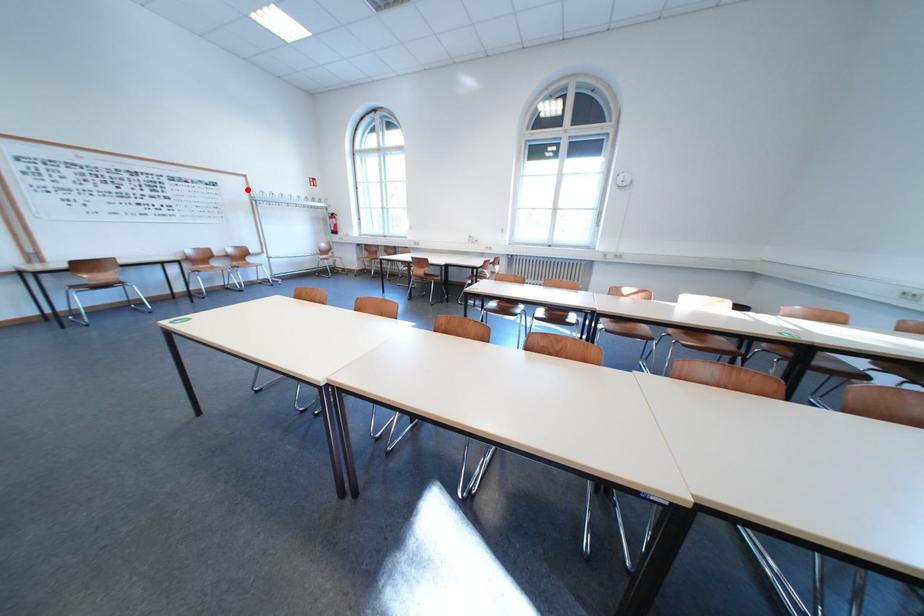
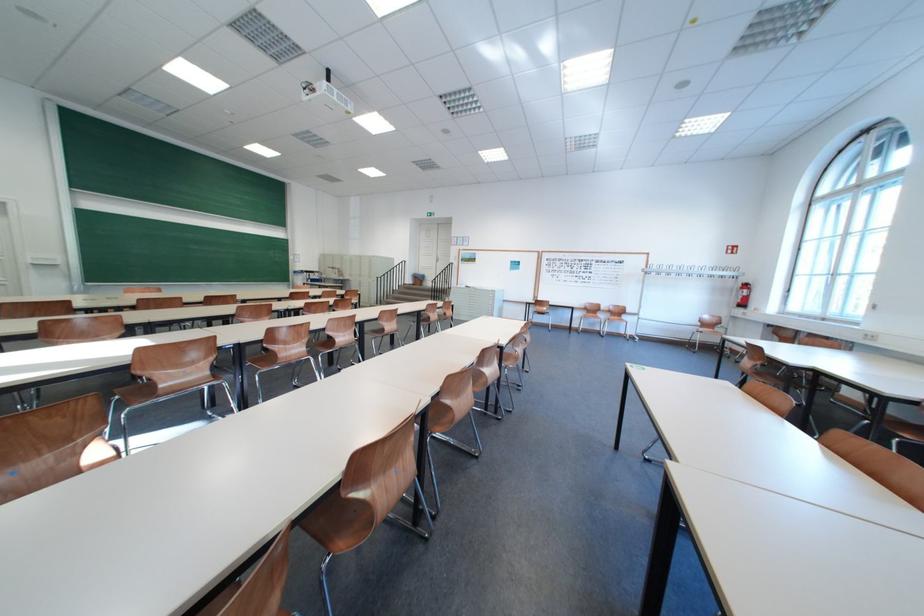
Find the pixel in the second image that matches the highlighted location in the first image.

(649, 265)